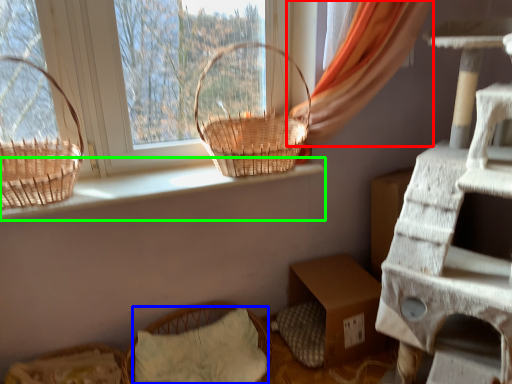
Question: Based on their relative distances, which object is nearer to curtain (highlighted by a red box)? Choose from pillow (highlighted by a blue box) and window sill (highlighted by a green box).

Choices:
 (A) pillow
 (B) window sill

Answer: (B)